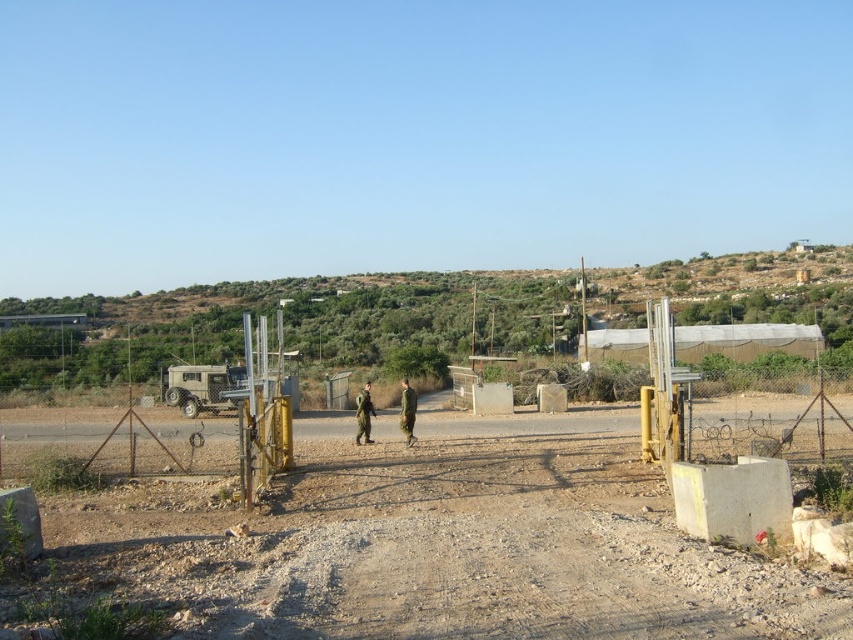
You are a drone operator tasked with identifying the location of a specific point in an image. The point is located at coordinates point (407, 412). Based on the scene description provided, what object or feature is located at this point?

The point (407, 412) corresponds to the green military uniform at center.